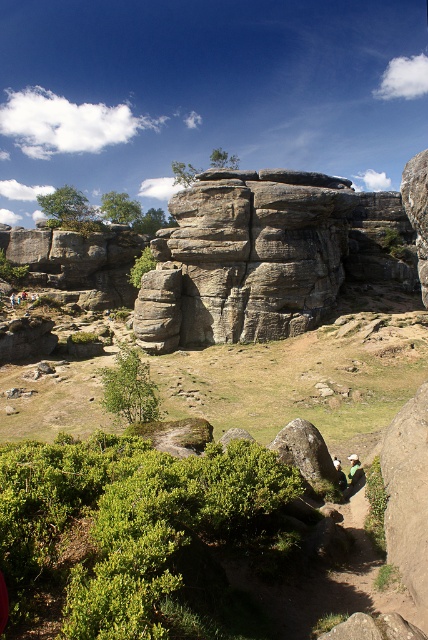
Question: Among these objects, which one is farthest from the camera?

Choices:
 (A) green mossy rock at center
 (B) gray/rough rock formation at center
 (C) green fabric rock climber at lower center

Answer: (B)

Question: Which point is closer to the camera?

Choices:
 (A) green mossy rock at center
 (B) gray/rough rock formation at center

Answer: (A)

Question: Can you confirm if green mossy rock at center is positioned below green fabric rock climber at lower center?

Choices:
 (A) no
 (B) yes

Answer: (A)

Question: Which of these objects is positioned closest to the green mossy rock at center?

Choices:
 (A) gray/rough rock formation at center
 (B) green fabric rock climber at lower center

Answer: (A)

Question: Where is gray/rough rock formation at center located in relation to green fabric rock climber at lower center in the image?

Choices:
 (A) above
 (B) below

Answer: (A)

Question: Does gray/rough rock formation at center have a smaller size compared to green fabric rock climber at lower center?

Choices:
 (A) yes
 (B) no

Answer: (B)